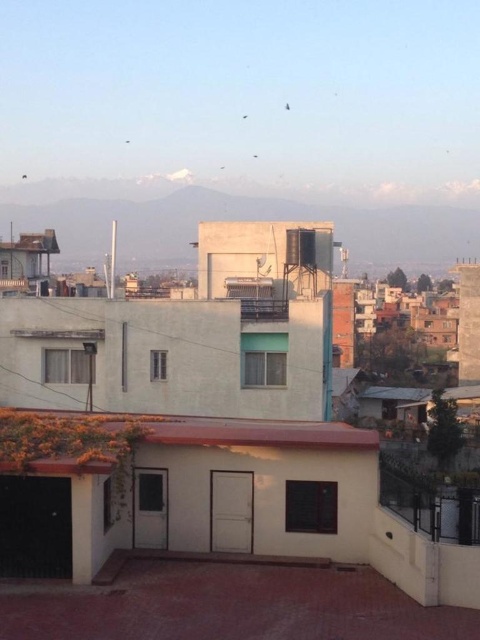
Who is more distant from viewer, (451, 259) or (172, 435)?

Point (451, 259)

Is white snow-covered mountain at upper center positioned before brown matte roof at center?

No, it is not.

Which is in front, point (137, 198) or point (24, 412)?

Positioned in front is point (24, 412).

Locate an element on the screen. Image resolution: width=480 pixels, height=640 pixels. white snow-covered mountain at upper center is located at coordinates (242, 220).